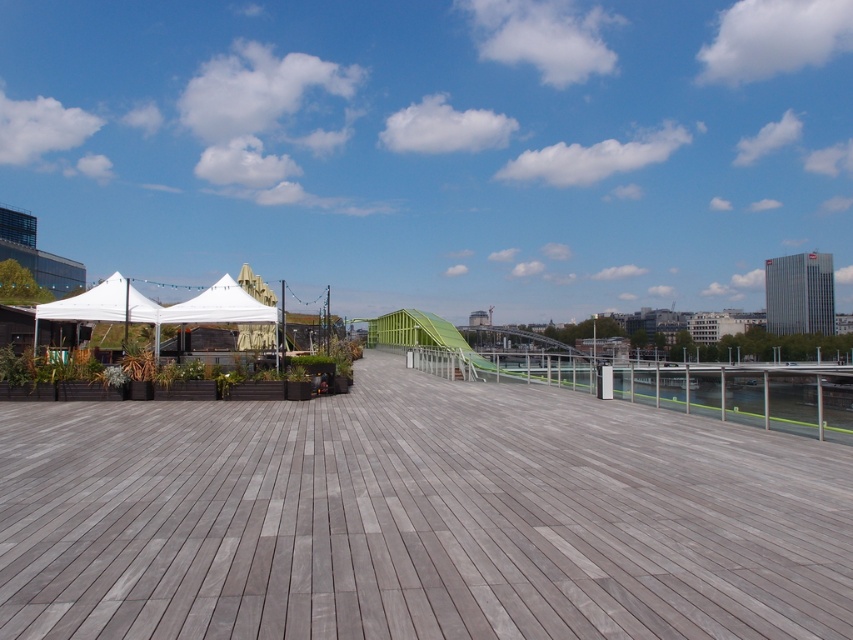
You are planning to place a large outdoor dining set on the gray wood deck at center. Considering the size of the dark green wooden planter at left, will there be enough space for the dining set?

The gray wood deck at center is bigger than the dark green wooden planter at left, so there should be enough space to place the dining set.

You are standing on the gray wood deck at center and want to climb up to the green plastic slide at center. Is the slide above or below the deck?

The gray wood deck at center is below the green plastic slide at center, so the slide is above the deck.